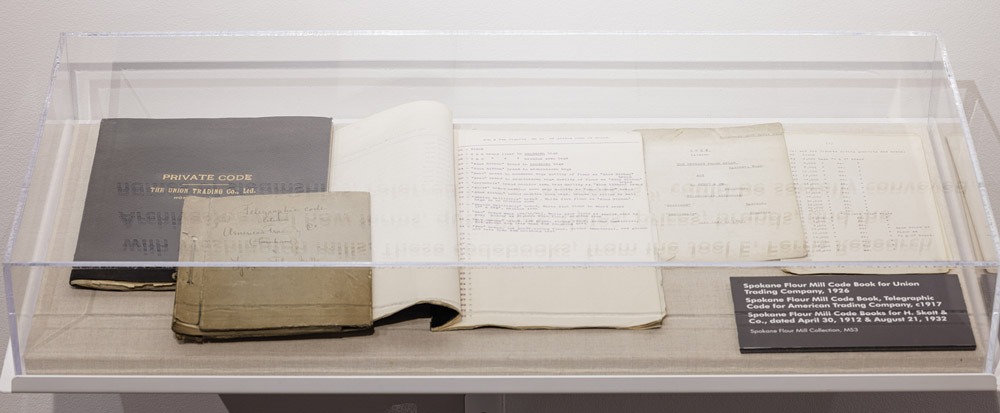
Locate an element on the screen. The height and width of the screenshot is (413, 1000). white wall background is located at coordinates point(567,21).